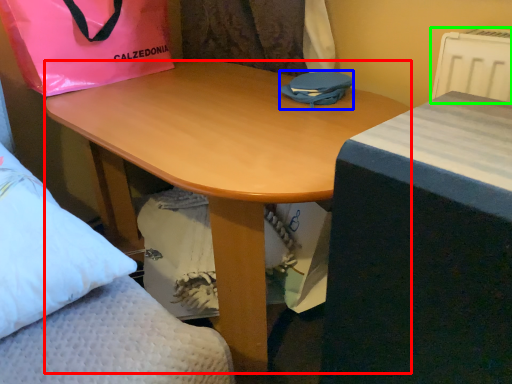
Question: Which object is positioned farthest from desk (highlighted by a red box)? Select from bag (highlighted by a blue box) and radiator (highlighted by a green box).

Choices:
 (A) bag
 (B) radiator

Answer: (B)